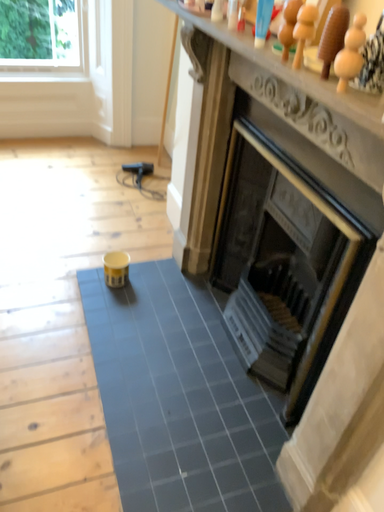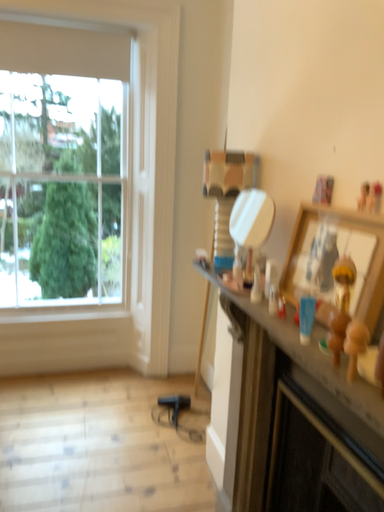
Question: Which way did the camera rotate in the video?

Choices:
 (A) rotated upward
 (B) rotated downward

Answer: (A)